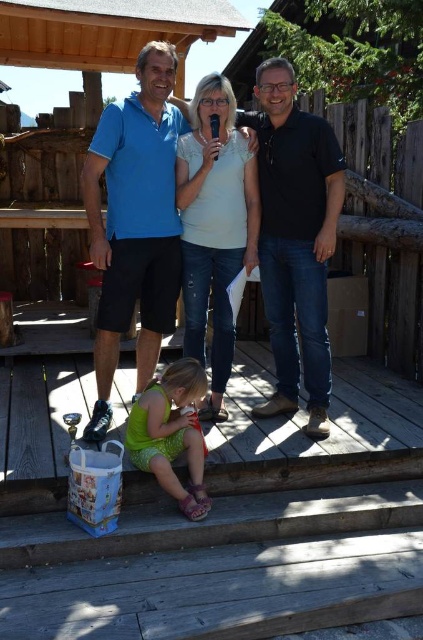
Describe the element at coordinates (134, 221) in the screenshot. This screenshot has width=423, height=640. I see `blue cotton shirt at center` at that location.

Between blue cotton shirt at center and dark blue polo shirt at right, which one has less height?

With less height is dark blue polo shirt at right.

What are the coordinates of `blue cotton shirt at center` in the screenshot? It's located at (134, 221).

Is point (290, 257) farther from viewer compared to point (197, 429)?

Yes.

Find the location of a particular element. The image size is (423, 640). dark blue polo shirt at right is located at coordinates (294, 236).

Can you confirm if blue cotton shirt at left is positioned below blue cotton shirt at center?

No, blue cotton shirt at left is not below blue cotton shirt at center.

Between blue cotton shirt at left and blue cotton shirt at center, which one is positioned higher?

blue cotton shirt at left is above.

Where is `blue cotton shirt at left`? The image size is (423, 640). blue cotton shirt at left is located at coordinates (134, 224).

Locate an element on the screen. This screenshot has height=640, width=423. blue cotton shirt at left is located at coordinates (134, 224).